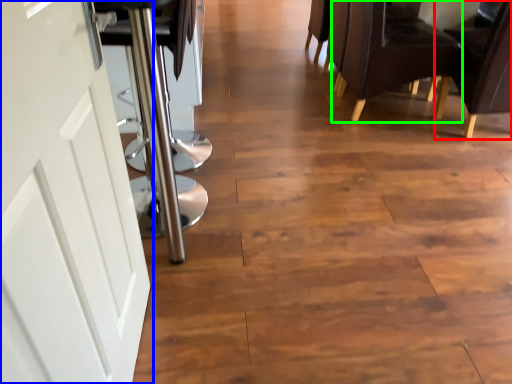
Question: Which is farther away from chair (highlighted by a red box)? door (highlighted by a blue box) or chair (highlighted by a green box)?

Choices:
 (A) door
 (B) chair

Answer: (A)